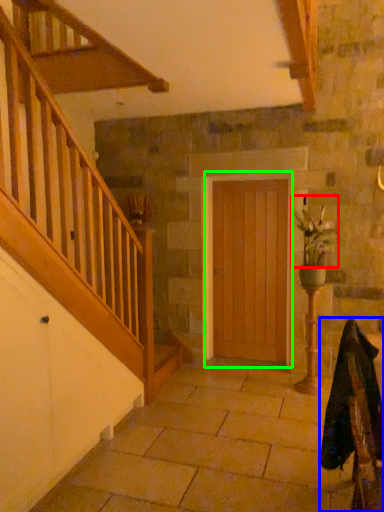
Question: Based on their relative distances, which object is farther from floral arrangement (highlighted by a red box)? Choose from rocking chair (highlighted by a blue box) and door (highlighted by a green box).

Choices:
 (A) rocking chair
 (B) door

Answer: (A)